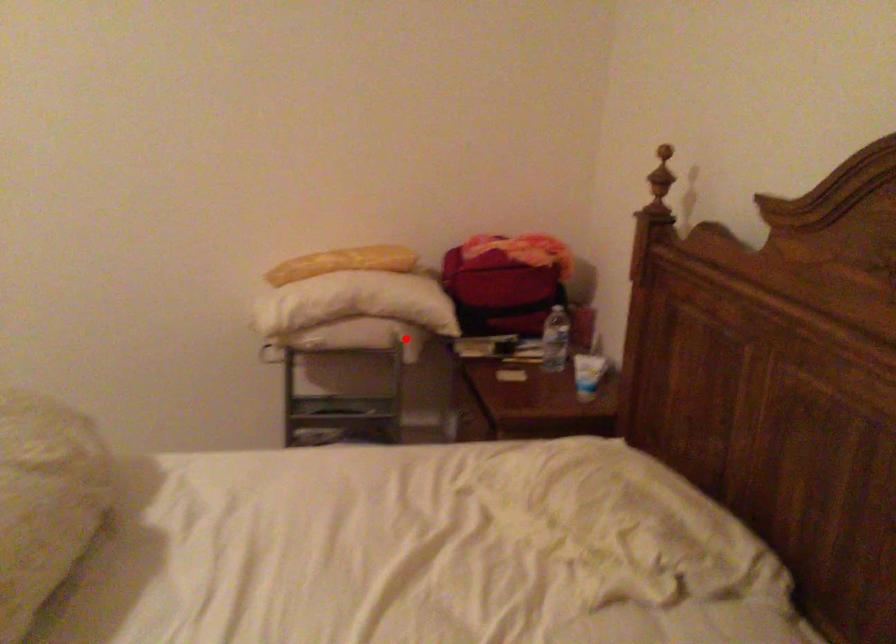
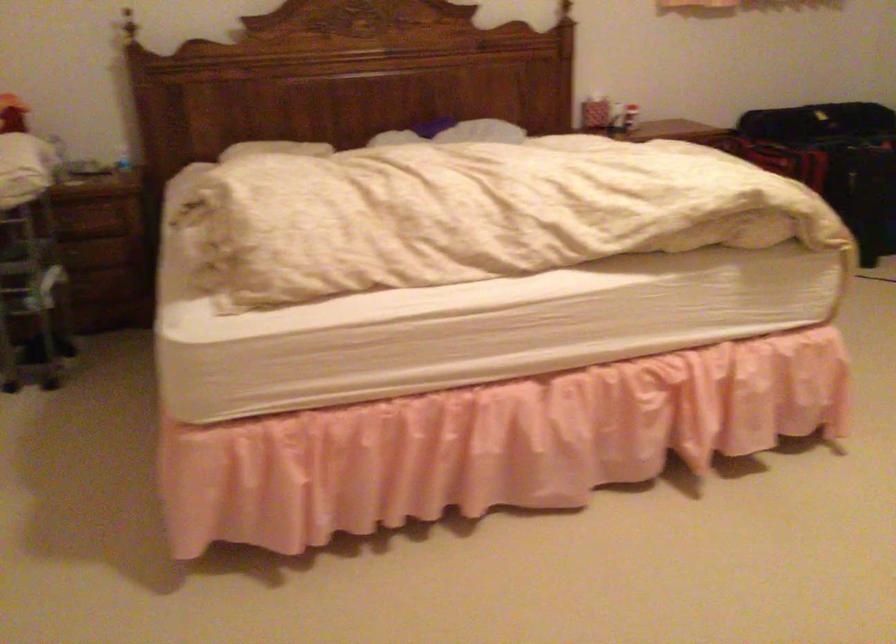
Question: I am providing you with two images of the same scene from different viewpoints. Image1 has a red point marked. In image2, the corresponding 3D location appears at what relative position? Reply with the corresponding letter.

Choices:
 (A) Closer
 (B) Farther

Answer: (B)